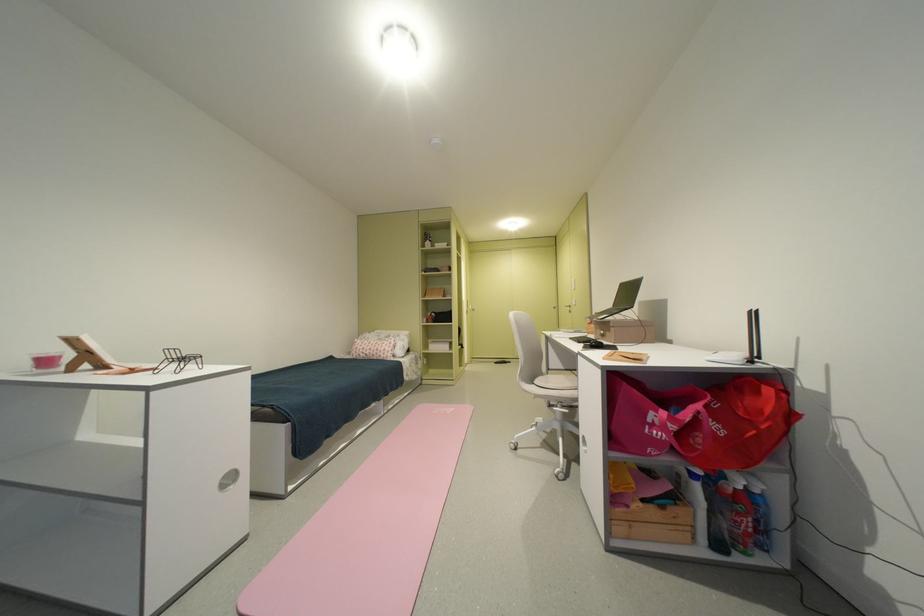
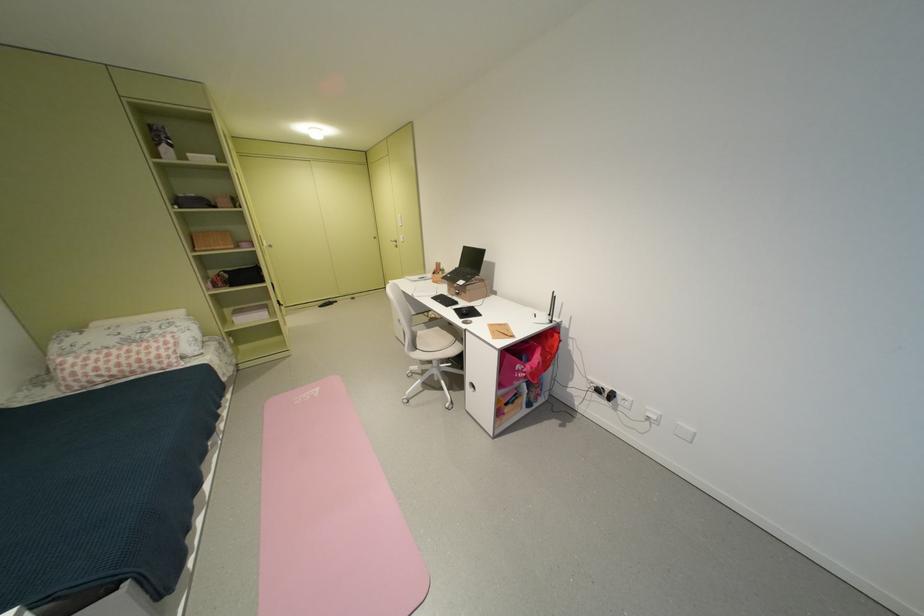
The point at (543, 383) is marked in the first image. Where is the corresponding point in the second image?

(428, 349)